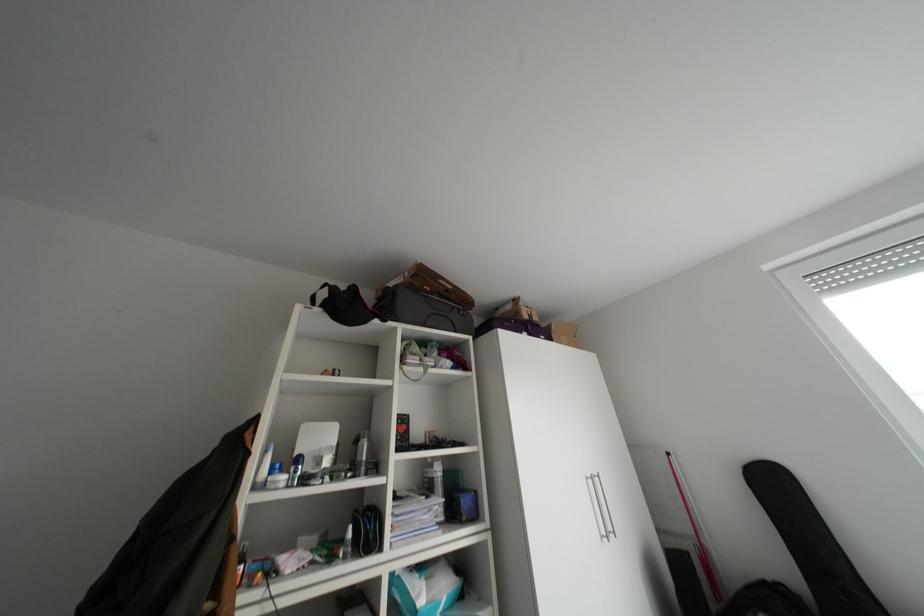
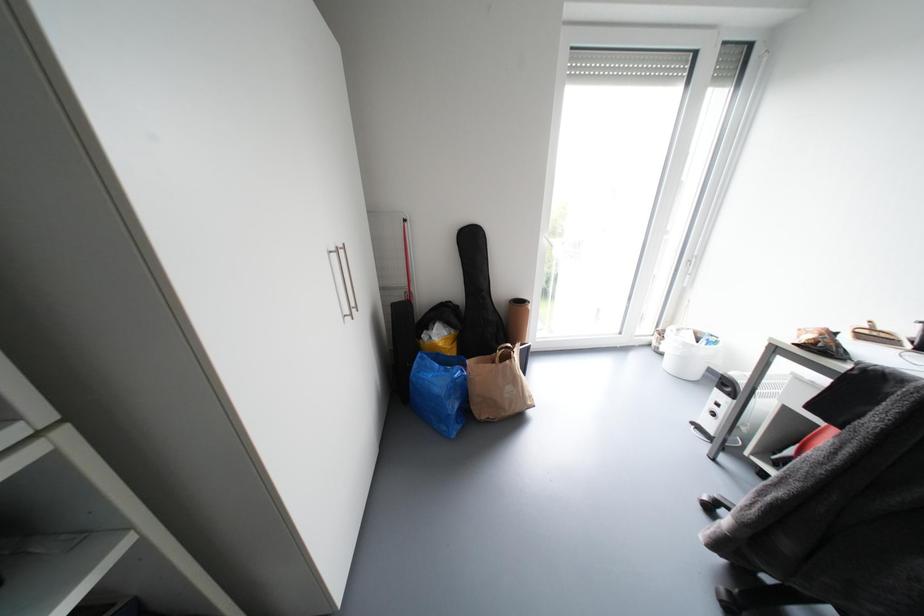
The images are taken continuously from a first-person perspective. In which direction is your viewpoint rotating?

The rotation direction of the camera is right-down.